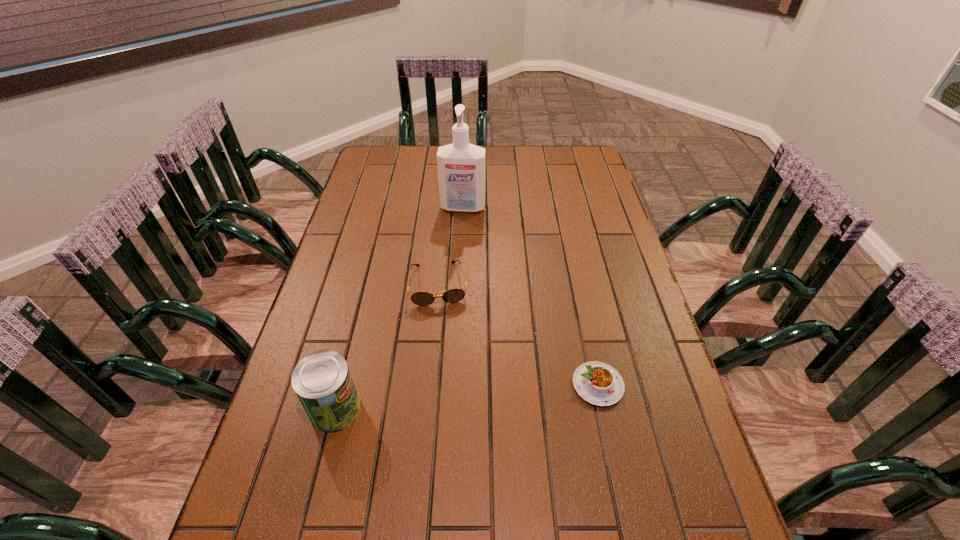
Locate an element on the screen. empty location between the pudding and the second shortest object is located at coordinates (518, 334).

Image resolution: width=960 pixels, height=540 pixels. What are the coordinates of `free space between the farthest object and the third shortest object` in the screenshot? It's located at (399, 308).

You are a GUI agent. You are given a task and a screenshot of the screen. Output one action in this format:
    pyautogui.click(x=<x>, y=<y>)
    Task: Click on the second closest object relative to the third shortest object
    
    Given the screenshot: What is the action you would take?
    pyautogui.click(x=597, y=383)

Point out which object is positioned as the nearest to the second farthest object. Please provide its 2D coordinates. Your answer should be formatted as a tuple, i.e. [(x, y)], where the tuple contains the x and y coordinates of a point satisfying the conditions above.

[(461, 166)]

You are a GUI agent. You are given a task and a screenshot of the screen. Output one action in this format:
    pyautogui.click(x=<x>, y=<y>)
    Task: Click on the free point that satisfies the following two spatial constraints: 1. on the back side of the third shortest object; 2. on the left side of the shortest object
    Image resolution: width=960 pixels, height=540 pixels.
    Given the screenshot: What is the action you would take?
    pyautogui.click(x=341, y=385)

At what (x,y) coordinates should I click in order to perform the action: click on free space that satisfies the following two spatial constraints: 1. on the back side of the sunglasses; 2. on the right side of the second tallest object. Please return your answer as a coordinate pair (x, y). Looking at the image, I should click on (367, 284).

I want to click on free location that satisfies the following two spatial constraints: 1. on the back side of the third tallest object; 2. on the right side of the can, so click(367, 284).